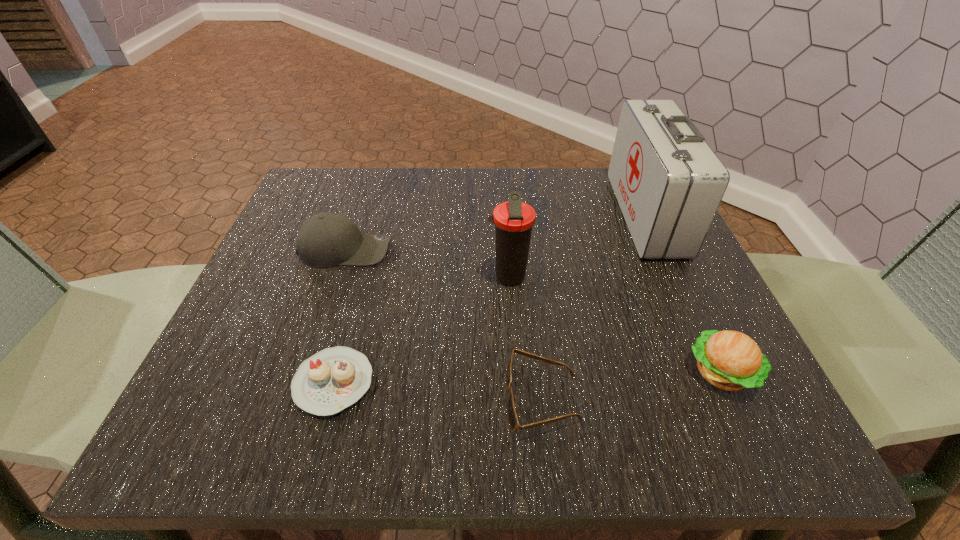
The width and height of the screenshot is (960, 540). What are the coordinates of `baseball cap positioned at the left edge` in the screenshot? It's located at (327, 239).

The height and width of the screenshot is (540, 960). In order to click on cupcake present at the left edge in this screenshot , I will do `click(333, 379)`.

Where is `the first-aid kit at the right edge`? This screenshot has width=960, height=540. the first-aid kit at the right edge is located at coordinates (668, 182).

You are a GUI agent. You are given a task and a screenshot of the screen. Output one action in this format:
    pyautogui.click(x=<x>, y=<y>)
    Task: Click on the hamburger present at the right edge
    The width and height of the screenshot is (960, 540).
    Given the screenshot: What is the action you would take?
    pyautogui.click(x=730, y=360)

Where is `object that is at the near left corner`? The height and width of the screenshot is (540, 960). object that is at the near left corner is located at coordinates (333, 379).

The height and width of the screenshot is (540, 960). I want to click on object at the far right corner, so click(668, 182).

Locate an element on the screen. object present at the near right corner is located at coordinates (730, 360).

At what (x,y) coordinates should I click in order to perform the action: click on free space at the far edge of the desktop. Please return your answer as a coordinate pair (x, y). The width and height of the screenshot is (960, 540). Looking at the image, I should click on (433, 180).

Find the location of a particular element. The height and width of the screenshot is (540, 960). vacant space at the near edge of the desktop is located at coordinates (404, 411).

This screenshot has height=540, width=960. What are the coordinates of `free space at the left edge of the desktop` in the screenshot? It's located at (282, 291).